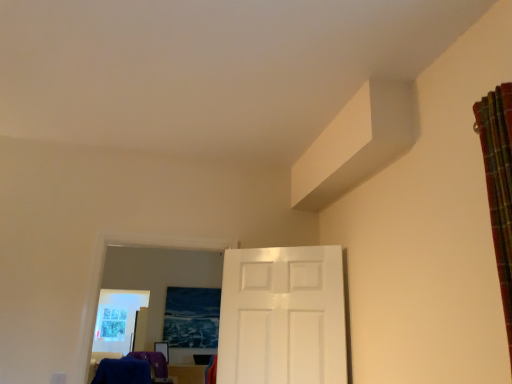
Identify the location of plaid fabric curtain at right. The height and width of the screenshot is (384, 512). (499, 184).

Locate an element on the screen. This screenshot has width=512, height=384. blue fuzzy laundry at lower left is located at coordinates (133, 369).

From the image's perspective, who appears lower, blue fuzzy laundry at lower left or plaid fabric curtain at right?

From the image's view, blue fuzzy laundry at lower left is below.

Does blue fuzzy laundry at lower left have a greater width compared to plaid fabric curtain at right?

Yes, blue fuzzy laundry at lower left is wider than plaid fabric curtain at right.

Is blue fuzzy laundry at lower left in contact with plaid fabric curtain at right?

No, blue fuzzy laundry at lower left is not next to plaid fabric curtain at right.

Is white glossy door at center not within blue fuzzy laundry at lower left?

white glossy door at center is positioned outside blue fuzzy laundry at lower left.

Would you say white glossy door at center is a long distance from blue fuzzy laundry at lower left?

Yes, white glossy door at center is far from blue fuzzy laundry at lower left.

Consider the image. Considering the sizes of objects white glossy door at center and blue fuzzy laundry at lower left in the image provided, who is wider, white glossy door at center or blue fuzzy laundry at lower left?

blue fuzzy laundry at lower left is wider.

Who is bigger, blue fuzzy laundry at lower left or white glossy door at center?

white glossy door at center is bigger.

Looking at their sizes, would you say blue fuzzy laundry at lower left is wider or thinner than white glossy door at center?

Clearly, blue fuzzy laundry at lower left has more width compared to white glossy door at center.

Is white glossy door at center surrounded by blue fuzzy laundry at lower left?

No, blue fuzzy laundry at lower left does not contain white glossy door at center.

From the image's perspective, which one is positioned higher, blue fuzzy laundry at lower left or white glossy door at center?

white glossy door at center.

Which of these two, plaid fabric curtain at right or blue fuzzy laundry at lower left, is smaller?

With smaller size is plaid fabric curtain at right.

Is plaid fabric curtain at right placed right next to blue fuzzy laundry at lower left?

plaid fabric curtain at right and blue fuzzy laundry at lower left are not in contact.

Is blue fuzzy laundry at lower left at the back of plaid fabric curtain at right?

No.

Considering the positions of objects plaid fabric curtain at right and white glossy door at center in the image provided, who is in front, plaid fabric curtain at right or white glossy door at center?

plaid fabric curtain at right.

How far apart are plaid fabric curtain at right and white glossy door at center?

5.00 feet.

Between plaid fabric curtain at right and white glossy door at center, which one appears on the left side from the viewer's perspective?

Positioned to the left is white glossy door at center.

From a real-world perspective, is plaid fabric curtain at right below white glossy door at center?

No, from a real-world perspective, plaid fabric curtain at right is not below white glossy door at center.

From the picture: Looking at their sizes, would you say white glossy door at center is wider or thinner than plaid fabric curtain at right?

In the image, white glossy door at center appears to be more narrow than plaid fabric curtain at right.

Considering the positions of objects white glossy door at center and plaid fabric curtain at right in the image provided, who is more to the right, white glossy door at center or plaid fabric curtain at right?

plaid fabric curtain at right is more to the right.

Is white glossy door at center positioned with its back to plaid fabric curtain at right?

white glossy door at center is not turned away from plaid fabric curtain at right.

Where is `laundry on the left of plaid fabric curtain at right`? laundry on the left of plaid fabric curtain at right is located at coordinates (133, 369).

The image size is (512, 384). What are the coordinates of `door on the right of blue fuzzy laundry at lower left` in the screenshot? It's located at (283, 316).

Based on the photo, from the image, which object appears to be farther from white glossy door at center, blue fuzzy laundry at lower left or plaid fabric curtain at right?

Among the two, blue fuzzy laundry at lower left is located further to white glossy door at center.

Which object lies nearer to the anchor point blue fuzzy laundry at lower left, plaid fabric curtain at right or white glossy door at center?

Among the two, white glossy door at center is located nearer to blue fuzzy laundry at lower left.

Which object lies further to the anchor point white glossy door at center, plaid fabric curtain at right or blue fuzzy laundry at lower left?

Among the two, blue fuzzy laundry at lower left is located further to white glossy door at center.

Looking at the image, which one is located further to plaid fabric curtain at right, blue fuzzy laundry at lower left or white glossy door at center?

blue fuzzy laundry at lower left is positioned further to the anchor plaid fabric curtain at right.

Based on their spatial positions, is white glossy door at center or blue fuzzy laundry at lower left closer to plaid fabric curtain at right?

white glossy door at center lies closer to plaid fabric curtain at right than the other object.

When comparing their distances from blue fuzzy laundry at lower left, does white glossy door at center or plaid fabric curtain at right seem further?

Based on the image, plaid fabric curtain at right appears to be further to blue fuzzy laundry at lower left.

At what (x,y) coordinates should I click in order to perform the action: click on door between plaid fabric curtain at right and blue fuzzy laundry at lower left in the front-back direction. Please return your answer as a coordinate pair (x, y). This screenshot has height=384, width=512. Looking at the image, I should click on (283, 316).